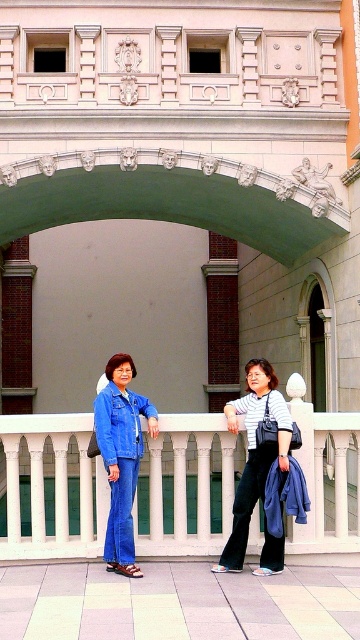
Question: Which of the following is the farthest from the observer?

Choices:
 (A) (205, 461)
 (B) (113, 380)
 (C) (248, 410)
 (D) (69, 170)

Answer: (D)

Question: Which of the following is the closest to the observer?

Choices:
 (A) denim jacket at center
 (B) green stone arch at center
 (C) striped cotton shirt at center

Answer: (A)

Question: Which point is farther from the camera taking this photo?

Choices:
 (A) (344, 496)
 (B) (160, 218)
 (C) (243, 548)
 (D) (132, 451)

Answer: (B)

Question: Is white marble balustrade at center further to camera compared to green stone arch at center?

Choices:
 (A) no
 (B) yes

Answer: (A)

Question: Does white marble balustrade at center appear on the left side of denim jacket at center?

Choices:
 (A) yes
 (B) no

Answer: (B)

Question: From the image, what is the correct spatial relationship of green stone arch at center in relation to denim jacket at center?

Choices:
 (A) below
 (B) above

Answer: (B)